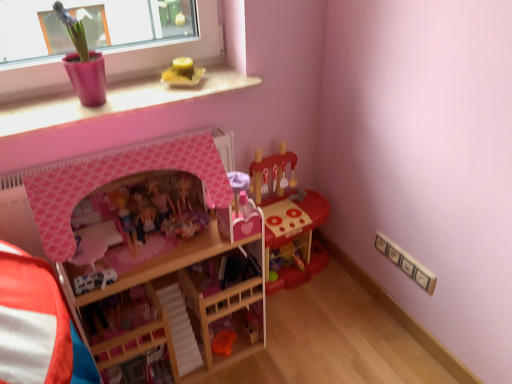
I want to click on vacant area that is situated to the right of wooden bunk bed at center, so tap(296, 343).